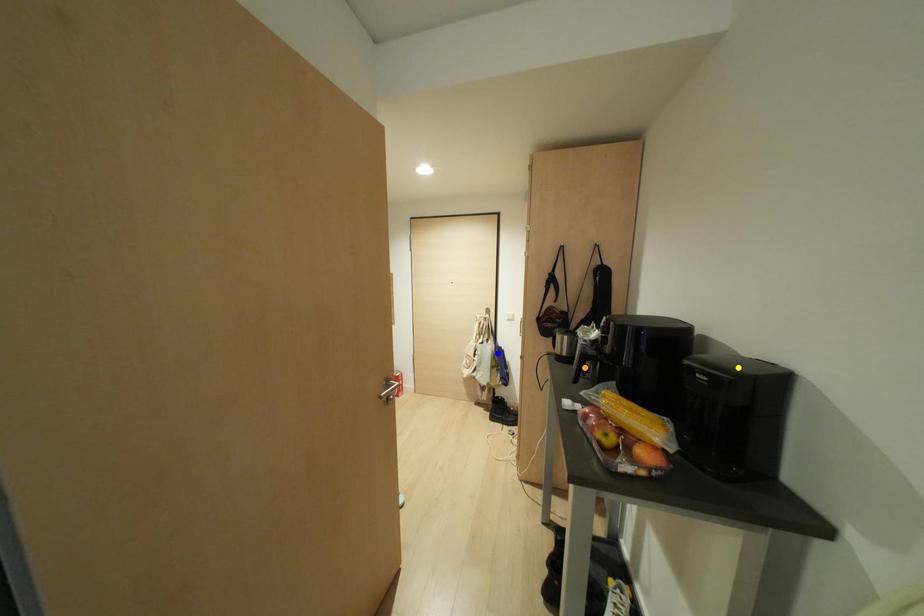
Order these from nearest to farthest:
orange point
blue point
yellow point

1. yellow point
2. orange point
3. blue point